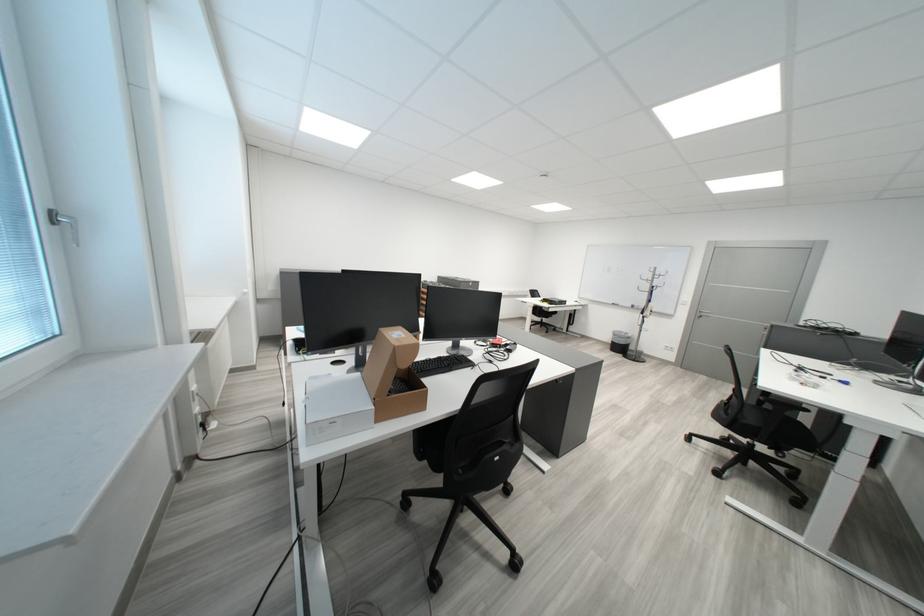
At what (x,y) coordinates should I click in order to perform the action: click on metal door handle. Please return your answer as a coordinate pair (x, y). The height and width of the screenshot is (616, 924). Looking at the image, I should click on (704, 312).